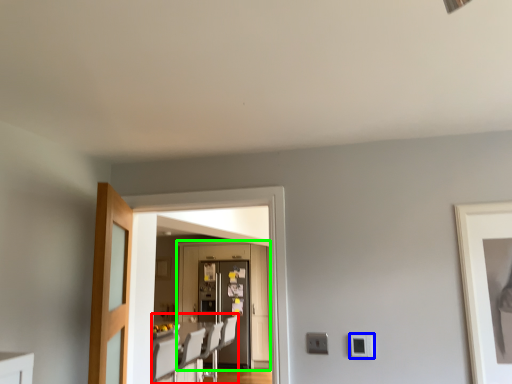
Question: Which object is positioned farthest from furniture (highlighted by a red box)? Select from light switch (highlighted by a blue box) and door (highlighted by a green box).

Choices:
 (A) light switch
 (B) door

Answer: (A)